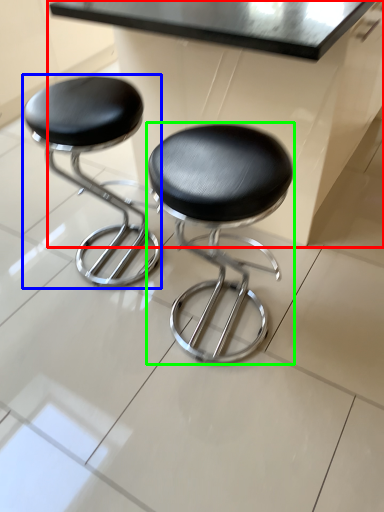
Question: Which object is positioned closest to table (highlighted by a red box)? Select from stool (highlighted by a blue box) and stool (highlighted by a green box).

Choices:
 (A) stool
 (B) stool

Answer: (B)